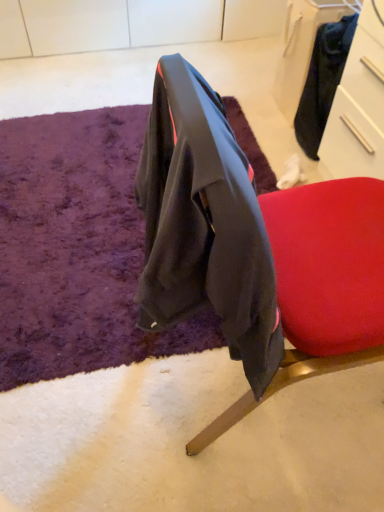
Question: From a real-world perspective, is velvet-like black jacket at center above or below purple shaggy rug at center?

Choices:
 (A) above
 (B) below

Answer: (A)

Question: Is velvet-like black jacket at center bigger or smaller than purple shaggy rug at center?

Choices:
 (A) small
 (B) big

Answer: (B)

Question: Based on their relative distances, which object is nearer to the purple shaggy rug at center?

Choices:
 (A) velvet-like black jacket at center
 (B) black fabric drawer at upper right

Answer: (A)

Question: Which object is the closest to the purple shaggy rug at center?

Choices:
 (A) velvet-like black jacket at center
 (B) black fabric drawer at upper right

Answer: (A)